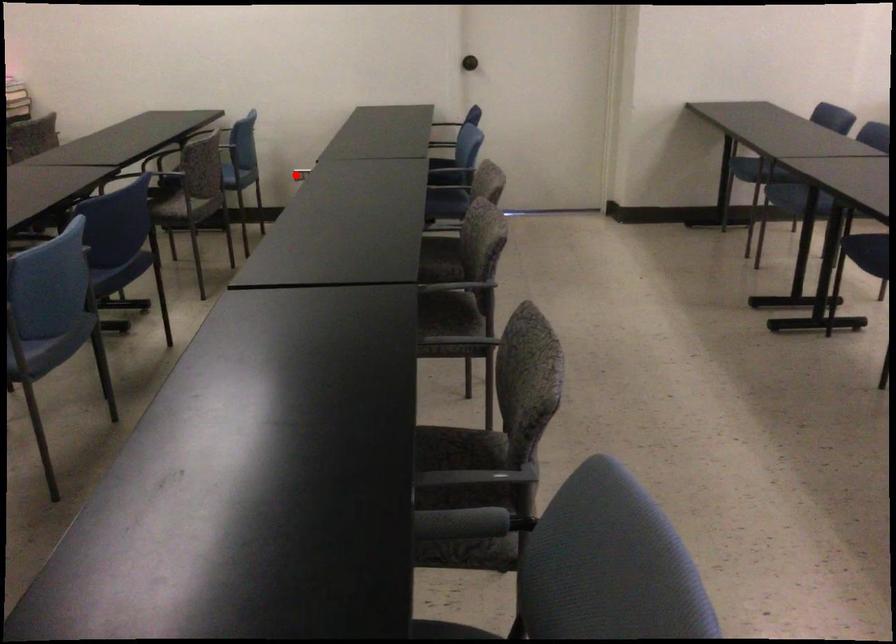
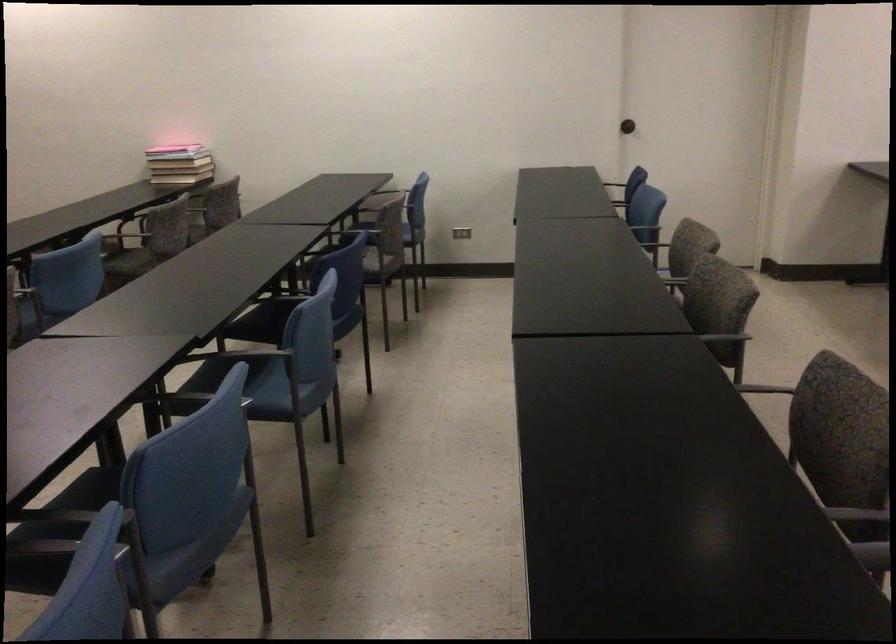
Locate, in the second image, the point that corresponds to the highlighted location in the first image.

(461, 232)